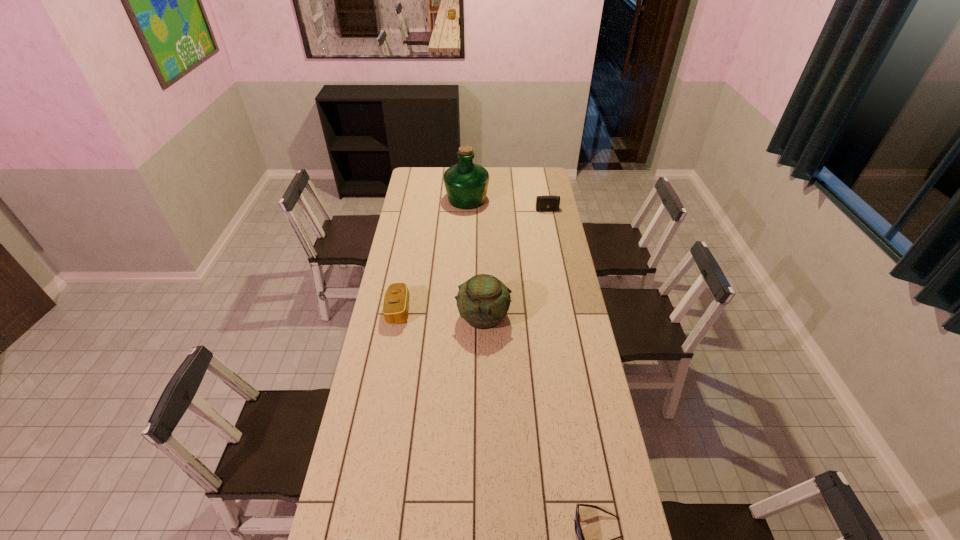
Identify the location of free space at the far edge of the desktop. (495, 171).

This screenshot has width=960, height=540. In order to click on free space at the left edge of the desktop in this screenshot , I will do `click(365, 406)`.

Locate an element on the screen. This screenshot has width=960, height=540. blank space at the right edge of the desktop is located at coordinates (560, 230).

Where is `free space at the far right corner of the desktop`? The image size is (960, 540). free space at the far right corner of the desktop is located at coordinates (526, 186).

You are a GUI agent. You are given a task and a screenshot of the screen. Output one action in this format:
    pyautogui.click(x=<x>, y=<y>)
    Task: Click on the vacant space that's between the farther clutch bag and the tallest object
    The height and width of the screenshot is (540, 960).
    Given the screenshot: What is the action you would take?
    pyautogui.click(x=507, y=205)

What are the coordinates of `free area in between the pottery and the nearer clutch bag` in the screenshot? It's located at (441, 313).

At what (x,y) coordinates should I click in order to perform the action: click on free space between the fifth shortest object and the right clutch bag. Please return your answer as a coordinate pair (x, y). The width and height of the screenshot is (960, 540). Looking at the image, I should click on (516, 262).

This screenshot has width=960, height=540. I want to click on free spot between the right clutch bag and the second tallest object, so click(x=516, y=262).

Image resolution: width=960 pixels, height=540 pixels. I want to click on object identified as the fifth closest to the left clutch bag, so click(578, 530).

What are the coordinates of `object that can be found as the fifth closest to the left clutch bag` in the screenshot? It's located at (578, 530).